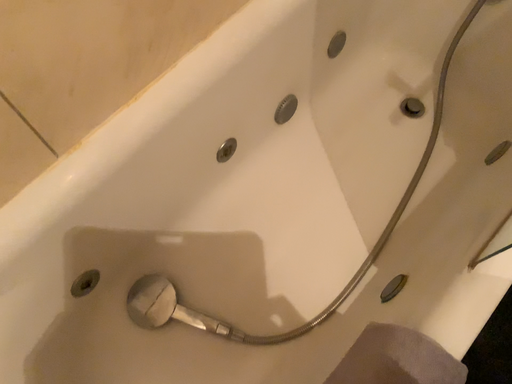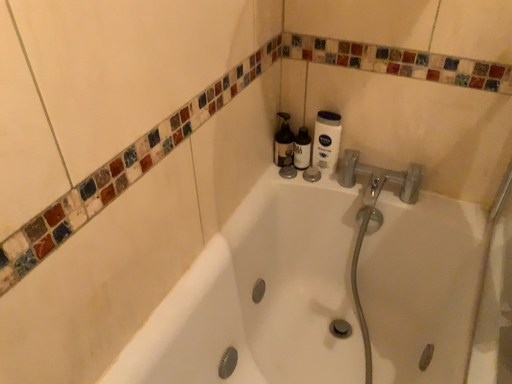
Question: Which way did the camera rotate in the video?

Choices:
 (A) rotated upward
 (B) rotated downward

Answer: (A)